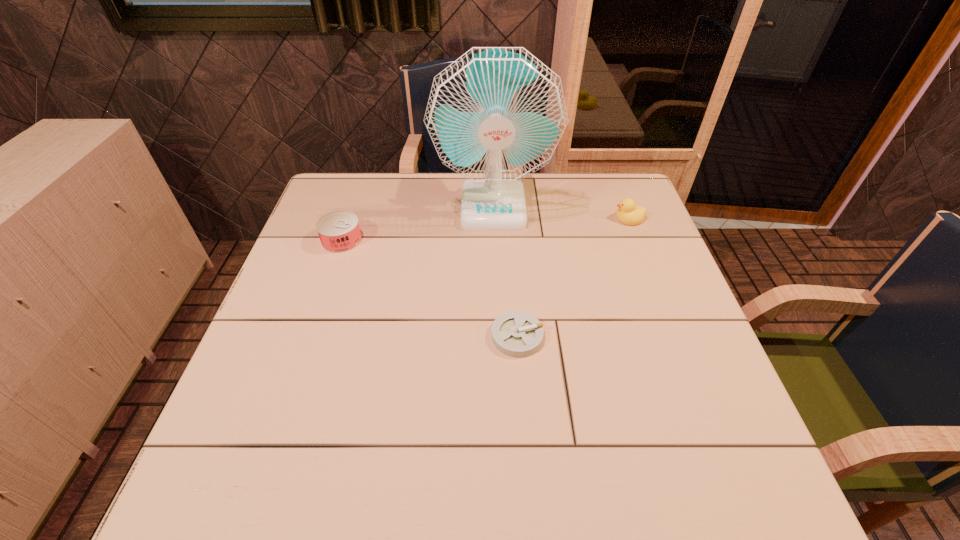
The image size is (960, 540). I want to click on vacant space that satisfies the following two spatial constraints: 1. on the front side of the can; 2. on the right side of the shortest object, so click(309, 336).